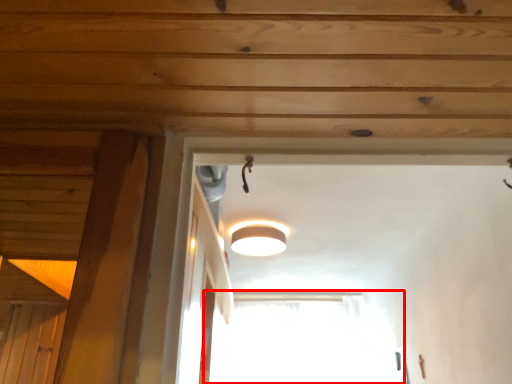
Question: From the image's perspective, where is window (annotated by the red box) located in relation to lamp in the image?

Choices:
 (A) below
 (B) above

Answer: (A)